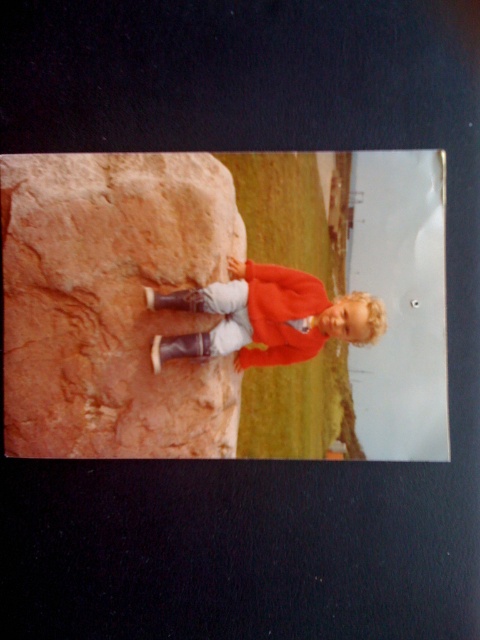
You are a photographer trying to capture a closeup shot of the rustic brown rock at left while also including the matte red jacket at center in the frame. Based on the scene described, is the distance between them sufficient to allow both subjects to be in the same frame without needing to zoom out?

The distance between the rustic brown rock at left and the matte red jacket at center is 11.51 centimeters. Since this distance is relatively small, it should be possible to capture both subjects in the same frame without needing to zoom out excessively, provided the camera has an appropriate focal length.

You are a photographer trying to capture a shot of the matte red jacket at center and the rustic brown rock at left. Based on their positions, which object should you focus on first if you want to frame them both in a single shot without moving the camera?

The rustic brown rock at left is to the left of the matte red jacket at center, so you should focus on the rustic brown rock at left first to ensure both are in frame.

You are a photographer analyzing the composition of this vintage image. The rustic brown rock at left is represented by point (112, 304). Based on the rule of thirds grid, does this point fall on one of the intersection points?

The rustic brown rock at left is represented by point (112, 304). The rule of thirds grid divides the image into a 3x3 grid, creating nine intersection points. The coordinates of these points are at approximately 1 and 2 thirds horizontally and vertically. The point (112, 304) corresponds to roughly 47.5 percent horizontally and 23.5 percent vertically. Since the rule of thirds intersections are at 33.3 and 66.6 percent, this point does not align with any of them.